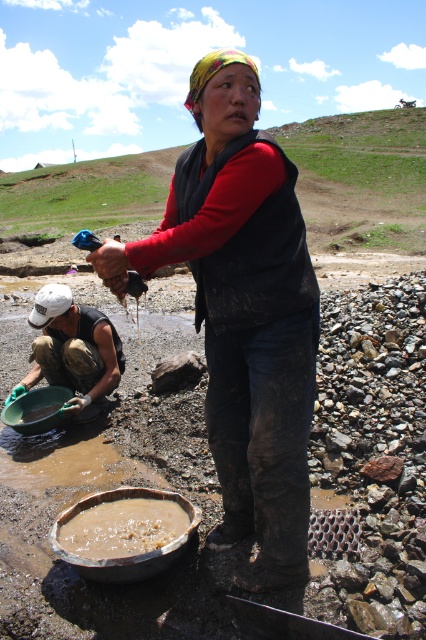
Is dark blue jeans at center in front of brown clay pot at lower center?

Yes, it is.

Who is positioned more to the left, dark blue jeans at center or brown clay pot at lower center?

brown clay pot at lower center

Is point (207, 349) less distant than point (101, 544)?

No, it is behind (101, 544).

Locate an element on the screen. This screenshot has height=640, width=426. dark blue jeans at center is located at coordinates (242, 312).

The width and height of the screenshot is (426, 640). What do you see at coordinates (72, 349) in the screenshot?
I see `white matte helmet at lower left` at bounding box center [72, 349].

Who is more distant from viewer, (x=36, y=365) or (x=160, y=524)?

Point (x=36, y=365)

This screenshot has height=640, width=426. I want to click on white matte helmet at lower left, so click(72, 349).

The height and width of the screenshot is (640, 426). I want to click on white matte helmet at lower left, so coord(72,349).

Which is in front, point (161, 232) or point (48, 301)?

Positioned in front is point (161, 232).

Who is positioned more to the left, dark blue jeans at center or white matte helmet at lower left?

From the viewer's perspective, white matte helmet at lower left appears more on the left side.

Between point (310, 268) and point (92, 396), which one is positioned in front?

Point (310, 268) is more forward.

In order to click on dark blue jeans at center in this screenshot , I will do `click(242, 312)`.